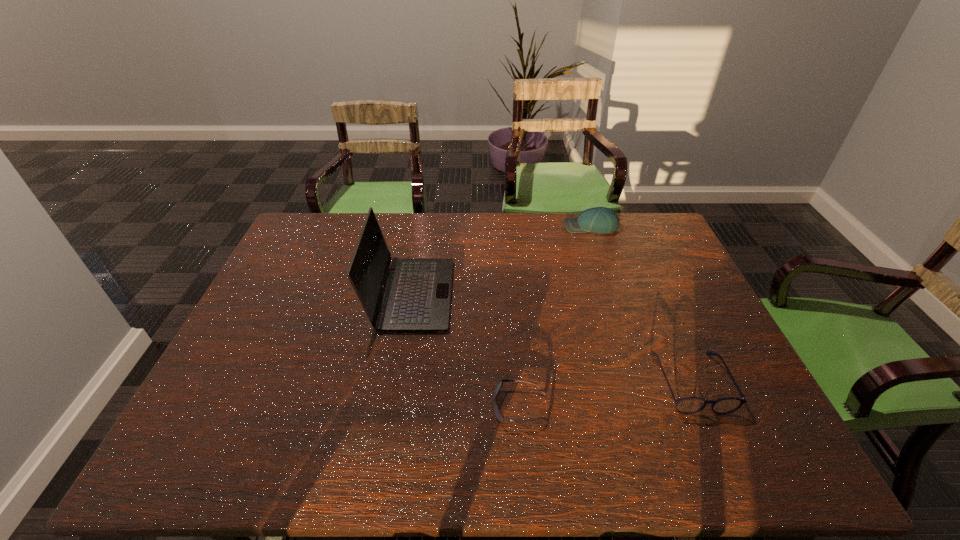
Locate an element on the screen. The width and height of the screenshot is (960, 540). free space between the farthest object and the sunglasses is located at coordinates (556, 316).

At what (x,y) coordinates should I click in order to perform the action: click on unoccupied area between the laptop computer and the second shortest object. Please return your answer as a coordinate pair (x, y). The height and width of the screenshot is (540, 960). Looking at the image, I should click on (551, 338).

Locate an element on the screen. This screenshot has width=960, height=540. empty space that is in between the sunglasses and the baseball cap is located at coordinates (556, 316).

Select which object is the third closest to the shortest object. Please provide its 2D coordinates. Your answer should be formatted as a tuple, i.e. [(x, y)], where the tuple contains the x and y coordinates of a point satisfying the conditions above.

[(604, 220)]

What are the coordinates of `object that can be found as the third closest to the laptop computer` in the screenshot? It's located at (690, 405).

At what (x,y) coordinates should I click in order to perform the action: click on free point that satisfies the following two spatial constraints: 1. on the front side of the baseball cap; 2. on the lenses of the sunglasses. Please return your answer as a coordinate pair (x, y). Looking at the image, I should click on (x=650, y=407).

The height and width of the screenshot is (540, 960). Find the location of `free location that satisfies the following two spatial constraints: 1. on the front-facing side of the second shortest object; 2. on the lenses of the sunglasses`. free location that satisfies the following two spatial constraints: 1. on the front-facing side of the second shortest object; 2. on the lenses of the sunglasses is located at coordinates click(x=701, y=407).

Locate an element on the screen. This screenshot has height=540, width=960. free location that satisfies the following two spatial constraints: 1. on the front-facing side of the third tallest object; 2. on the lenses of the shortest object is located at coordinates (701, 407).